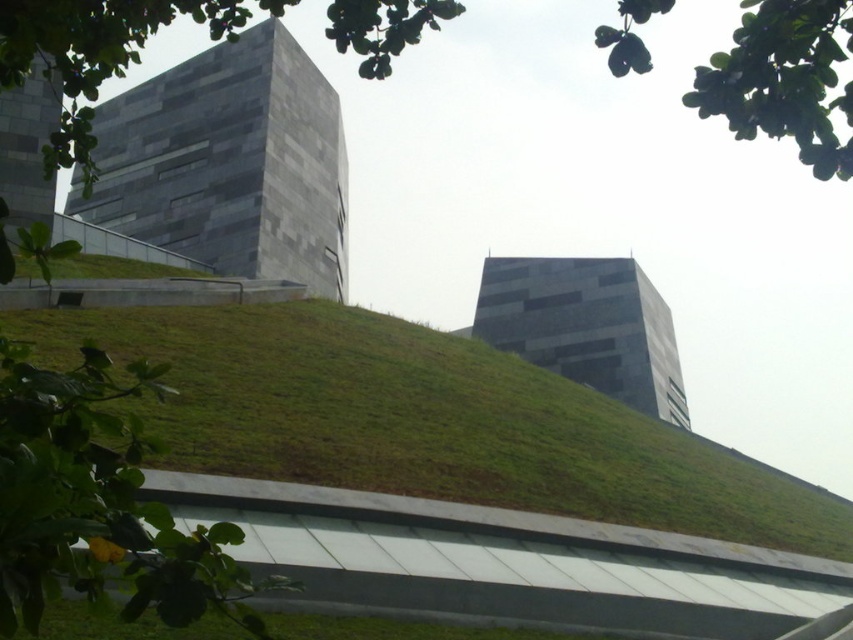
Is gray stone tower at upper left thinner than dark gray stone tower at center?

Incorrect, gray stone tower at upper left's width is not less than dark gray stone tower at center's.

Which is in front, point (280, 104) or point (515, 348)?

Point (280, 104) is in front.

Is point (337, 289) behind point (526, 305)?

No.

I want to click on gray stone tower at upper left, so click(x=229, y=163).

Can you confirm if gray stone tower at upper left is bigger than gray stone building at upper left?

Indeed, gray stone tower at upper left has a larger size compared to gray stone building at upper left.

Looking at this image, is gray stone tower at upper left smaller than gray stone building at upper left?

No.

Which is behind, point (316, 68) or point (44, 196)?

Positioned behind is point (316, 68).

Where is `gray stone tower at upper left`? gray stone tower at upper left is located at coordinates (229, 163).

Does point (599, 296) lie behind point (32, 164)?

Yes.

Is point (621, 298) in front of point (16, 156)?

No, (621, 298) is further to viewer.

You are a GUI agent. You are given a task and a screenshot of the screen. Output one action in this format:
    pyautogui.click(x=<x>, y=<y>)
    Task: Click on the dark gray stone tower at center
    Image resolution: width=853 pixels, height=640 pixels.
    Given the screenshot: What is the action you would take?
    pyautogui.click(x=585, y=326)